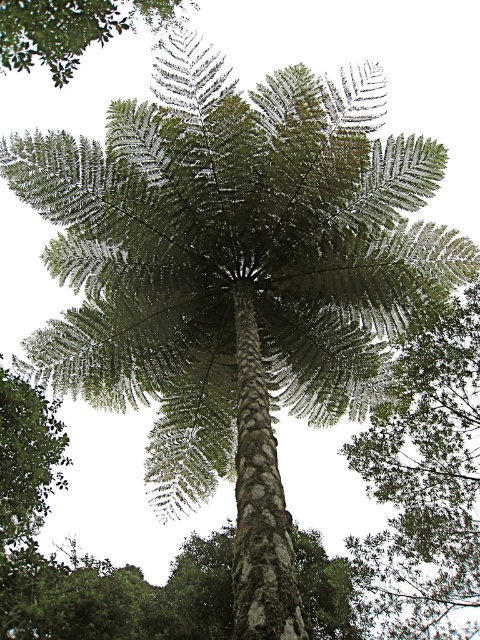
You are standing in a park and see a tall tree with an umbrella canopy. There is a point marked at coordinates (424, 481). Based on the scene, can you determine if this point is located on the tree or somewhere else?

The point (424, 481) is on the green leafy tree at center, so it is located on the tree.